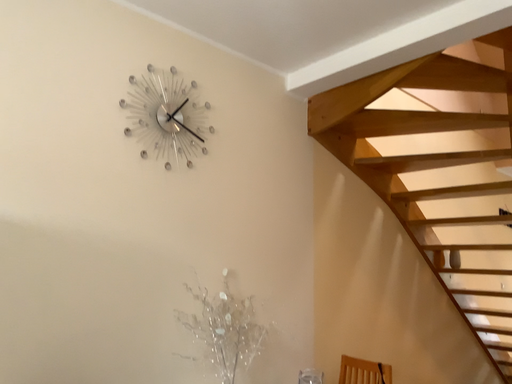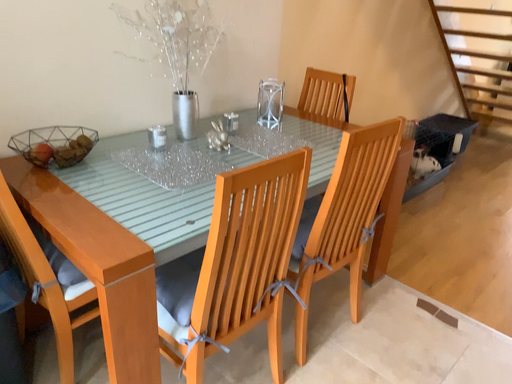
Question: Which way did the camera rotate in the video?

Choices:
 (A) rotated upward
 (B) rotated downward

Answer: (B)